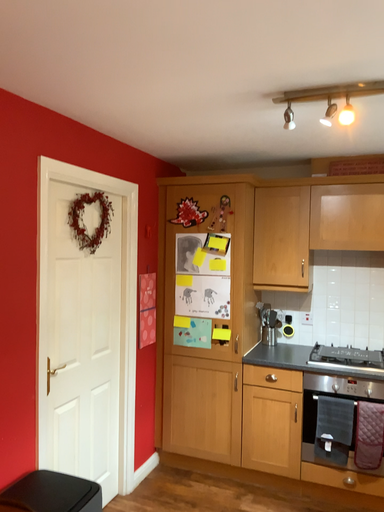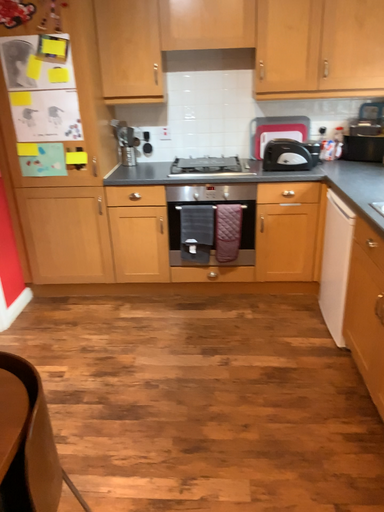
Question: How did the camera likely rotate when shooting the video?

Choices:
 (A) rotated upward
 (B) rotated downward

Answer: (B)